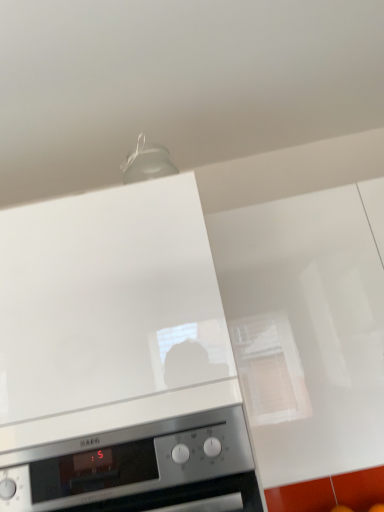
Question: Is there a large distance between white glossy range hood at upper center, the second home appliance positioned from the bottom, and satin silver oven at lower center, which is the second home appliance from top to bottom?

Choices:
 (A) yes
 (B) no

Answer: (B)

Question: Is white glossy range hood at upper center, the second home appliance positioned from the bottom, not within satin silver oven at lower center, which is the second home appliance from top to bottom?

Choices:
 (A) no
 (B) yes

Answer: (B)

Question: Considering the relative positions of white glossy range hood at upper center, the second home appliance positioned from the bottom, and satin silver oven at lower center, the 1th home appliance from the bottom, in the image provided, is white glossy range hood at upper center, the second home appliance positioned from the bottom, to the left of satin silver oven at lower center, the 1th home appliance from the bottom, from the viewer's perspective?

Choices:
 (A) yes
 (B) no

Answer: (A)

Question: Considering the relative sizes of white glossy range hood at upper center, the second home appliance positioned from the bottom, and satin silver oven at lower center, which is the second home appliance from top to bottom, in the image provided, is white glossy range hood at upper center, the second home appliance positioned from the bottom, bigger than satin silver oven at lower center, which is the second home appliance from top to bottom,?

Choices:
 (A) yes
 (B) no

Answer: (A)

Question: From a real-world perspective, is white glossy range hood at upper center, the second home appliance positioned from the bottom, located higher than satin silver oven at lower center, which is the second home appliance from top to bottom?

Choices:
 (A) no
 (B) yes

Answer: (B)

Question: Can you confirm if white glossy range hood at upper center, the second home appliance positioned from the bottom, is smaller than satin silver oven at lower center, the 1th home appliance from the bottom?

Choices:
 (A) no
 (B) yes

Answer: (A)

Question: Considering the relative sizes of satin silver oven at lower center, the 1th home appliance from the bottom, and white glossy range hood at upper center, which is the 1th home appliance from top to bottom, in the image provided, is satin silver oven at lower center, the 1th home appliance from the bottom, shorter than white glossy range hood at upper center, which is the 1th home appliance from top to bottom,?

Choices:
 (A) yes
 (B) no

Answer: (A)

Question: From the image's perspective, would you say satin silver oven at lower center, which is the second home appliance from top to bottom, is positioned over white glossy range hood at upper center, which is the 1th home appliance from top to bottom?

Choices:
 (A) yes
 (B) no

Answer: (B)

Question: Is satin silver oven at lower center, which is the second home appliance from top to bottom, bigger than white glossy range hood at upper center, the second home appliance positioned from the bottom?

Choices:
 (A) no
 (B) yes

Answer: (A)

Question: Does satin silver oven at lower center, the 1th home appliance from the bottom, have a smaller size compared to white glossy range hood at upper center, the second home appliance positioned from the bottom?

Choices:
 (A) yes
 (B) no

Answer: (A)

Question: Is there a large distance between satin silver oven at lower center, which is the second home appliance from top to bottom, and white glossy range hood at upper center, the second home appliance positioned from the bottom?

Choices:
 (A) no
 (B) yes

Answer: (A)

Question: Is satin silver oven at lower center, the 1th home appliance from the bottom, positioned behind white glossy range hood at upper center, which is the 1th home appliance from top to bottom?

Choices:
 (A) yes
 (B) no

Answer: (B)

Question: Is point (8, 470) closer or farther from the camera than point (221, 351)?

Choices:
 (A) closer
 (B) farther

Answer: (A)